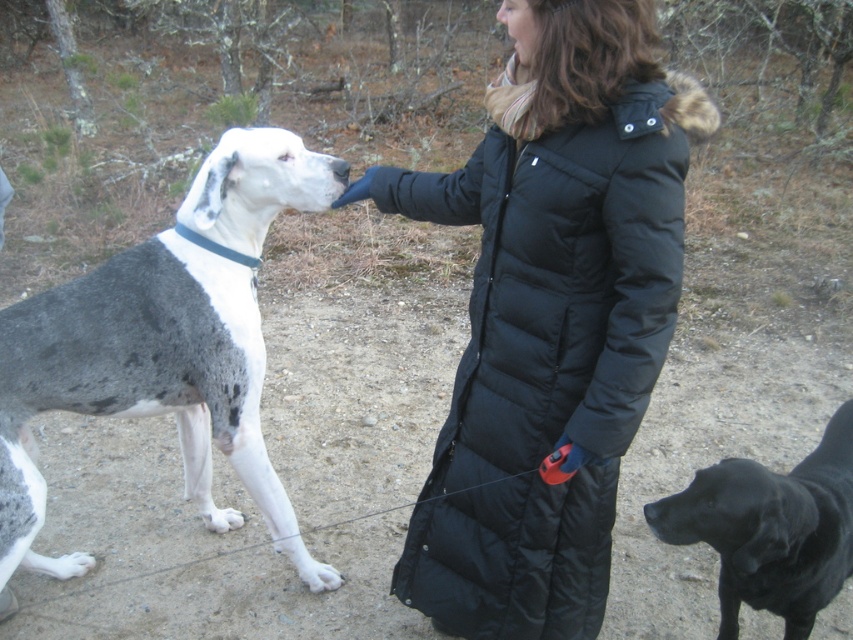
Can you confirm if black puffy coat at center is positioned to the left of black glossy dog at lower right?

Indeed, black puffy coat at center is positioned on the left side of black glossy dog at lower right.

Can you confirm if black puffy coat at center is shorter than black glossy dog at lower right?

Incorrect, black puffy coat at center's height does not fall short of black glossy dog at lower right's.

The height and width of the screenshot is (640, 853). Describe the element at coordinates (550, 316) in the screenshot. I see `black puffy coat at center` at that location.

What are the coordinates of `black puffy coat at center` in the screenshot? It's located at pos(550,316).

Which of these two, spotted fur dog at left or white fur paw at lower left, stands shorter?

white fur paw at lower left

Between spotted fur dog at left and white fur paw at lower left, which one has more height?

Standing taller between the two is spotted fur dog at left.

You are a GUI agent. You are given a task and a screenshot of the screen. Output one action in this format:
    pyautogui.click(x=<x>, y=<y>)
    Task: Click on the spotted fur dog at left
    The height and width of the screenshot is (640, 853).
    Given the screenshot: What is the action you would take?
    pyautogui.click(x=161, y=344)

Image resolution: width=853 pixels, height=640 pixels. Find the location of `spotted fur dog at left`. spotted fur dog at left is located at coordinates (161, 344).

Can you confirm if black glossy dog at lower right is shorter than black matte nose at upper center?

Yes.

Who is more forward, (744, 529) or (505, 13)?

Point (505, 13) is more forward.

Identify the location of black glossy dog at lower right. This screenshot has height=640, width=853. (770, 529).